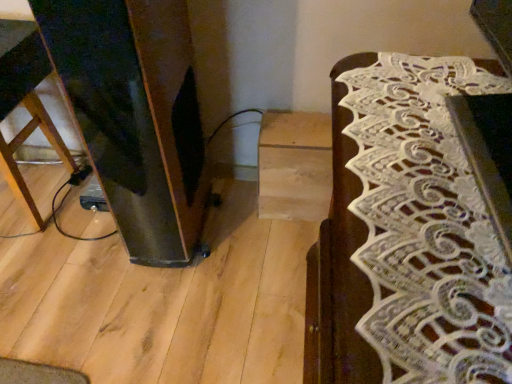
Locate an element on the screen. wooden stool at left, placed as the first furniture when sorted from left to right is located at coordinates (25, 103).

The height and width of the screenshot is (384, 512). What do you see at coordinates (25, 103) in the screenshot? I see `wooden stool at left, arranged as the second furniture when viewed from the right` at bounding box center [25, 103].

What do you see at coordinates (407, 234) in the screenshot? I see `white lace table runner at right, arranged as the first furniture when viewed from the front` at bounding box center [407, 234].

I want to click on white lace table runner at right, which appears as the 1th furniture when viewed from the right, so click(407, 234).

In order to face white lace table runner at right, arranged as the first furniture when viewed from the front, should I rotate leftwards or rightwards?

Turn right approximately 24.394 degrees to face it.

This screenshot has width=512, height=384. Find the location of `wooden stool at left, placed as the first furniture when sorted from left to right`. wooden stool at left, placed as the first furniture when sorted from left to right is located at coordinates (25, 103).

Is wooden stool at left, which is the first furniture in back-to-front order, to the left of white lace table runner at right, arranged as the first furniture when viewed from the front, from the viewer's perspective?

Correct, you'll find wooden stool at left, which is the first furniture in back-to-front order, to the left of white lace table runner at right, arranged as the first furniture when viewed from the front.

Considering the relative positions of wooden stool at left, which appears as the second furniture when viewed from the front, and white lace table runner at right, which appears as the 2th furniture when viewed from the back, in the image provided, is wooden stool at left, which appears as the second furniture when viewed from the front, in front of white lace table runner at right, which appears as the 2th furniture when viewed from the back,?

That is False.

Is point (10, 111) behind point (398, 365)?

Yes.

In the scene shown: From the image's perspective, which object appears higher, wooden stool at left, which is the first furniture in back-to-front order, or white lace table runner at right, which appears as the 1th furniture when viewed from the right?

wooden stool at left, which is the first furniture in back-to-front order.

From a real-world perspective, which object rests below the other?

In real-world perspective, wooden stool at left, which appears as the second furniture when viewed from the front, is lower.

Between wooden stool at left, which is the first furniture in back-to-front order, and white lace table runner at right, arranged as the first furniture when viewed from the front, which one has larger width?

Wider between the two is white lace table runner at right, arranged as the first furniture when viewed from the front.

Considering the relative sizes of wooden stool at left, which is the first furniture in back-to-front order, and white lace table runner at right, which appears as the second furniture when viewed from the left, in the image provided, is wooden stool at left, which is the first furniture in back-to-front order, shorter than white lace table runner at right, which appears as the second furniture when viewed from the left,?

No.

In the scene shown: Considering the relative sizes of wooden stool at left, which is the first furniture in back-to-front order, and white lace table runner at right, which appears as the 1th furniture when viewed from the right, in the image provided, is wooden stool at left, which is the first furniture in back-to-front order, smaller than white lace table runner at right, which appears as the 1th furniture when viewed from the right,?

Actually, wooden stool at left, which is the first furniture in back-to-front order, might be larger than white lace table runner at right, which appears as the 1th furniture when viewed from the right.

Would you say wooden stool at left, arranged as the second furniture when viewed from the right, is outside white lace table runner at right, which appears as the 1th furniture when viewed from the right?

That's correct, wooden stool at left, arranged as the second furniture when viewed from the right, is outside of white lace table runner at right, which appears as the 1th furniture when viewed from the right.

Is wooden stool at left, placed as the first furniture when sorted from left to right, in contact with white lace table runner at right, which appears as the 1th furniture when viewed from the right?

wooden stool at left, placed as the first furniture when sorted from left to right, and white lace table runner at right, which appears as the 1th furniture when viewed from the right, are not in contact.

Consider the image. Could you tell me if wooden stool at left, arranged as the second furniture when viewed from the right, is facing white lace table runner at right, which appears as the 2th furniture when viewed from the back?

No, wooden stool at left, arranged as the second furniture when viewed from the right, is not oriented towards white lace table runner at right, which appears as the 2th furniture when viewed from the back.

Measure the distance between wooden stool at left, placed as the first furniture when sorted from left to right, and white lace table runner at right, which appears as the 2th furniture when viewed from the back.

They are 36.97 inches apart.

Where is `furniture above the white lace table runner at right, which appears as the second furniture when viewed from the left (from the image's perspective)`? The width and height of the screenshot is (512, 384). furniture above the white lace table runner at right, which appears as the second furniture when viewed from the left (from the image's perspective) is located at coordinates (25, 103).

Consider the image. Considering the positions of objects white lace table runner at right, arranged as the first furniture when viewed from the front, and wooden stool at left, which appears as the second furniture when viewed from the front, in the image provided, who is more to the left, white lace table runner at right, arranged as the first furniture when viewed from the front, or wooden stool at left, which appears as the second furniture when viewed from the front,?

wooden stool at left, which appears as the second furniture when viewed from the front, is more to the left.

Is white lace table runner at right, which appears as the 2th furniture when viewed from the back, in front of wooden stool at left, placed as the first furniture when sorted from left to right?

Yes, white lace table runner at right, which appears as the 2th furniture when viewed from the back, is in front of wooden stool at left, placed as the first furniture when sorted from left to right.

Considering the points (507, 79) and (14, 24), which point is behind, point (507, 79) or point (14, 24)?

The point (14, 24) is farther.

From the image's perspective, between white lace table runner at right, which appears as the 2th furniture when viewed from the back, and wooden stool at left, arranged as the second furniture when viewed from the right, who is located below?

white lace table runner at right, which appears as the 2th furniture when viewed from the back, appears lower in the image.

From a real-world perspective, between white lace table runner at right, which appears as the second furniture when viewed from the left, and wooden stool at left, arranged as the second furniture when viewed from the right, who is vertically higher?

In real-world perspective, white lace table runner at right, which appears as the second furniture when viewed from the left, is above.

Looking at this image, between white lace table runner at right, which appears as the 1th furniture when viewed from the right, and wooden stool at left, arranged as the second furniture when viewed from the right, which one has larger width?

white lace table runner at right, which appears as the 1th furniture when viewed from the right, is wider.

Can you confirm if white lace table runner at right, which appears as the second furniture when viewed from the left, is taller than wooden stool at left, arranged as the second furniture when viewed from the right?

In fact, white lace table runner at right, which appears as the second furniture when viewed from the left, may be shorter than wooden stool at left, arranged as the second furniture when viewed from the right.

Considering the relative sizes of white lace table runner at right, which appears as the 2th furniture when viewed from the back, and wooden stool at left, arranged as the second furniture when viewed from the right, in the image provided, is white lace table runner at right, which appears as the 2th furniture when viewed from the back, smaller than wooden stool at left, arranged as the second furniture when viewed from the right,?

Indeed, white lace table runner at right, which appears as the 2th furniture when viewed from the back, has a smaller size compared to wooden stool at left, arranged as the second furniture when viewed from the right.

Is white lace table runner at right, which appears as the second furniture when viewed from the left, positioned beyond the bounds of wooden stool at left, placed as the first furniture when sorted from left to right?

Absolutely, white lace table runner at right, which appears as the second furniture when viewed from the left, is external to wooden stool at left, placed as the first furniture when sorted from left to right.

Is white lace table runner at right, which appears as the second furniture when viewed from the left, not close to wooden stool at left, which appears as the second furniture when viewed from the front?

No, white lace table runner at right, which appears as the second furniture when viewed from the left, is in close proximity to wooden stool at left, which appears as the second furniture when viewed from the front.

Is white lace table runner at right, arranged as the first furniture when viewed from the front, looking in the opposite direction of wooden stool at left, which is the first furniture in back-to-front order?

No, white lace table runner at right, arranged as the first furniture when viewed from the front,'s orientation is not away from wooden stool at left, which is the first furniture in back-to-front order.

How many degrees apart are the facing directions of white lace table runner at right, which appears as the second furniture when viewed from the left, and wooden stool at left, arranged as the second furniture when viewed from the right?

92 degrees separate the facing orientations of white lace table runner at right, which appears as the second furniture when viewed from the left, and wooden stool at left, arranged as the second furniture when viewed from the right.

You are a GUI agent. You are given a task and a screenshot of the screen. Output one action in this format:
    pyautogui.click(x=<x>, y=<y>)
    Task: Click on the furniture behind the white lace table runner at right, which appears as the second furniture when viewed from the left
    The width and height of the screenshot is (512, 384).
    Given the screenshot: What is the action you would take?
    pyautogui.click(x=25, y=103)

I want to click on furniture above the white lace table runner at right, which appears as the 1th furniture when viewed from the right (from the image's perspective), so 25,103.

Locate an element on the screen. This screenshot has width=512, height=384. furniture that appears behind the white lace table runner at right, which appears as the 2th furniture when viewed from the back is located at coordinates (25, 103).